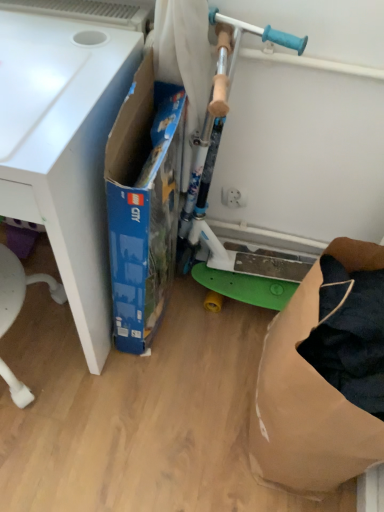
Locate an element on the screen. vacant area that is in front of blue cardboard box at center is located at coordinates (145, 383).